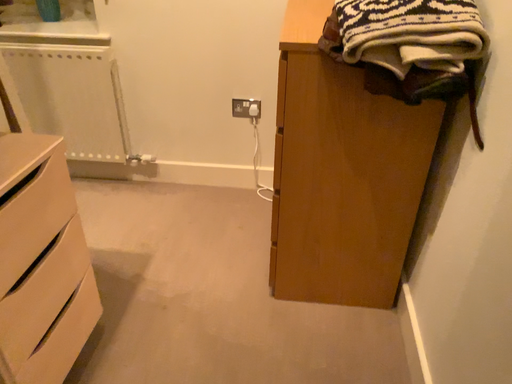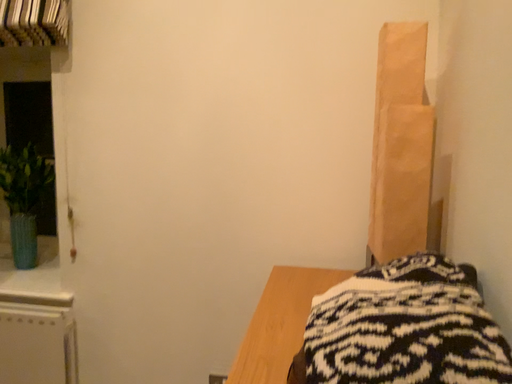
Question: Which way did the camera rotate in the video?

Choices:
 (A) rotated upward
 (B) rotated downward

Answer: (A)